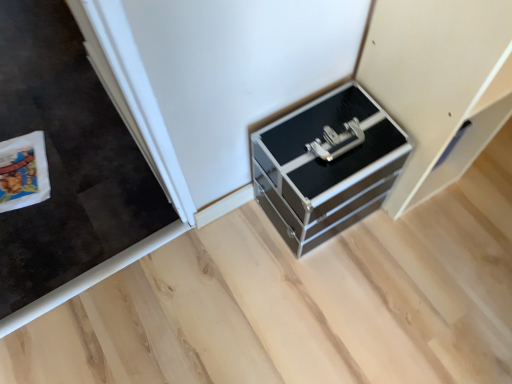
Find the location of a particular element. The height and width of the screenshot is (384, 512). vacant space situated above metallic black chest of drawers at center (from a real-world perspective) is located at coordinates (326, 134).